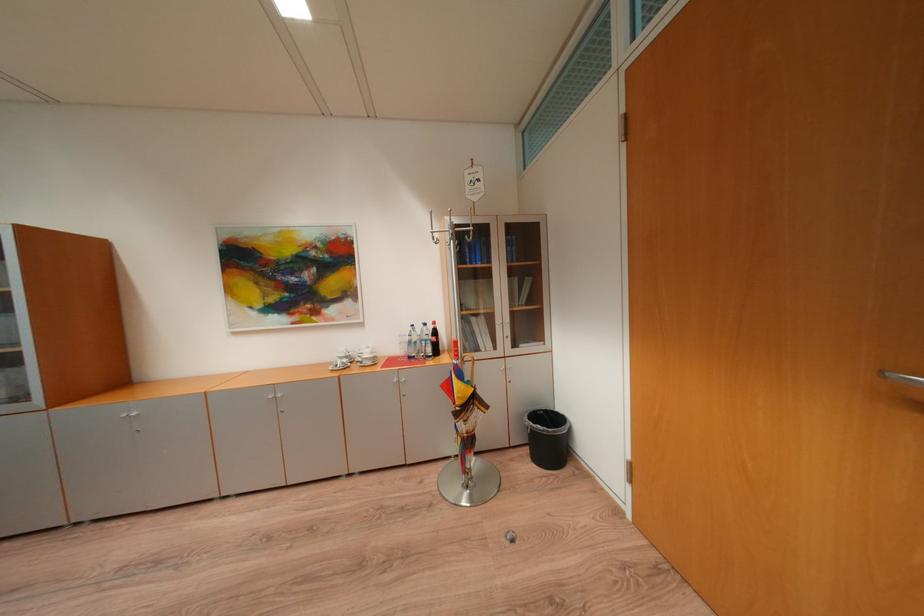
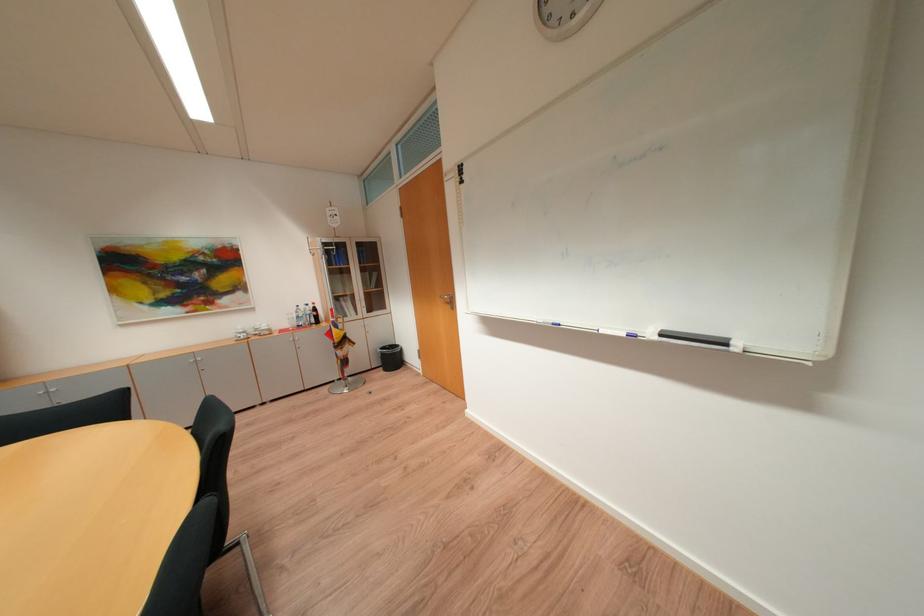
The point at (427, 329) is marked in the first image. Where is the corresponding point in the second image?

(310, 309)